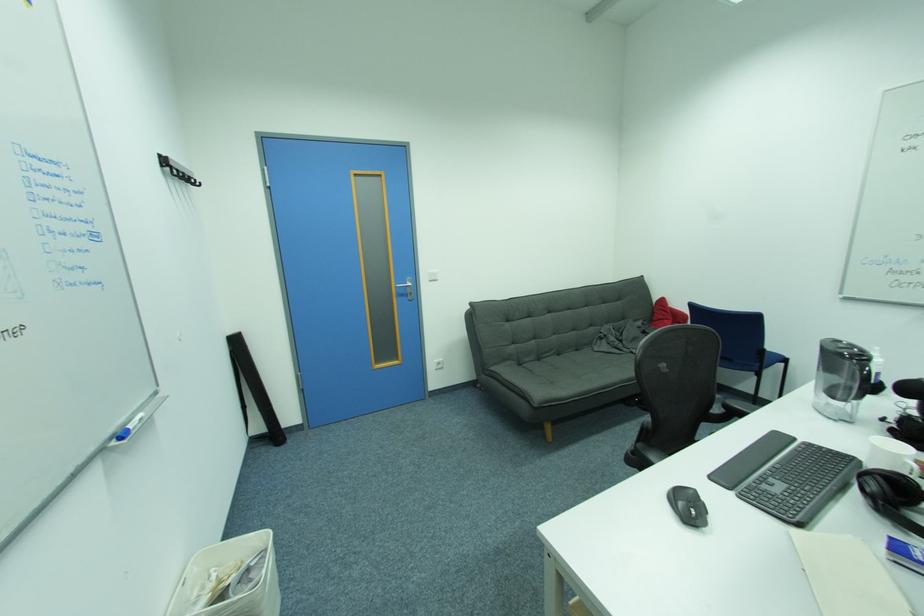
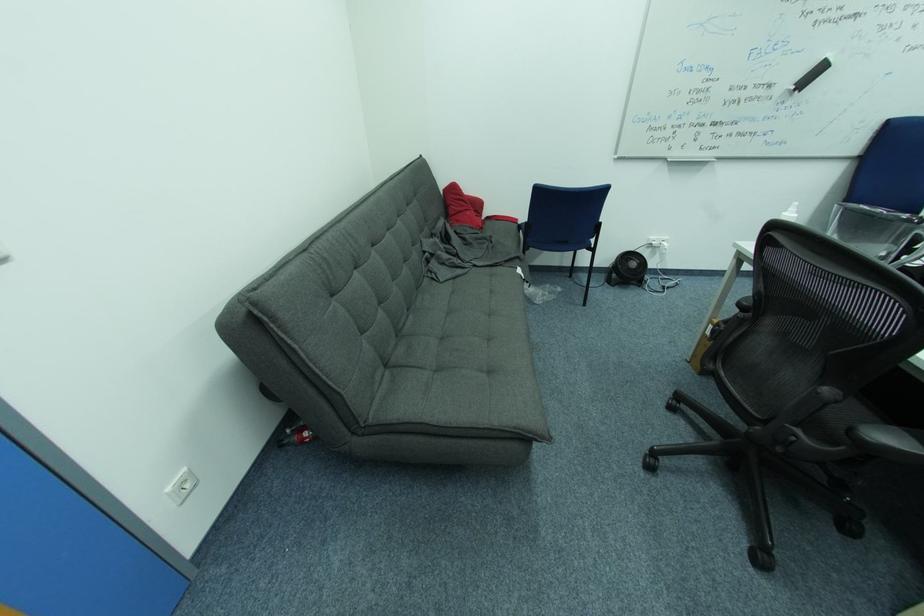
In the second image, find the point that corresponds to (x=565, y=355) in the first image.

(415, 312)